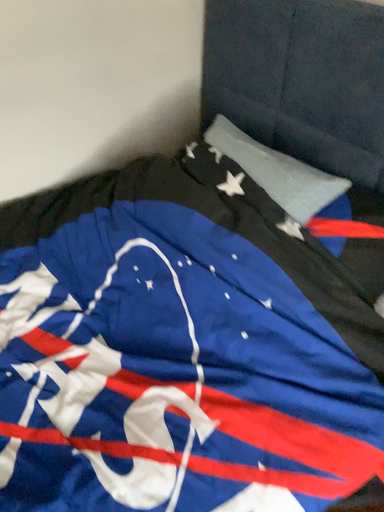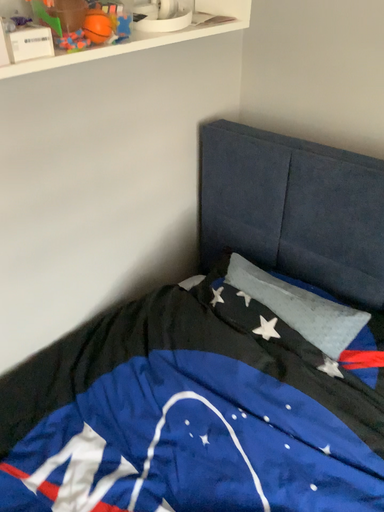
Question: Which way did the camera rotate in the video?

Choices:
 (A) rotated downward
 (B) rotated upward

Answer: (B)